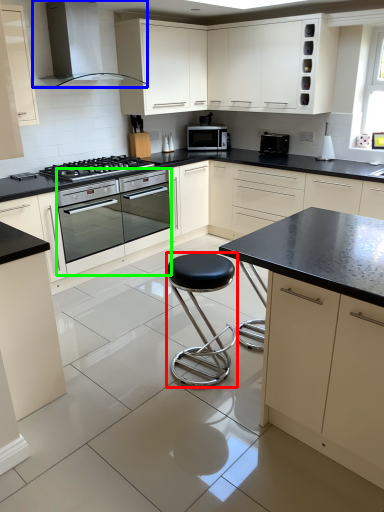
Question: Estimate the real-world distances between objects in this image. Which object is closer to stool (highlighted by a red box), home appliance (highlighted by a blue box) or oven (highlighted by a green box)?

Choices:
 (A) home appliance
 (B) oven

Answer: (B)